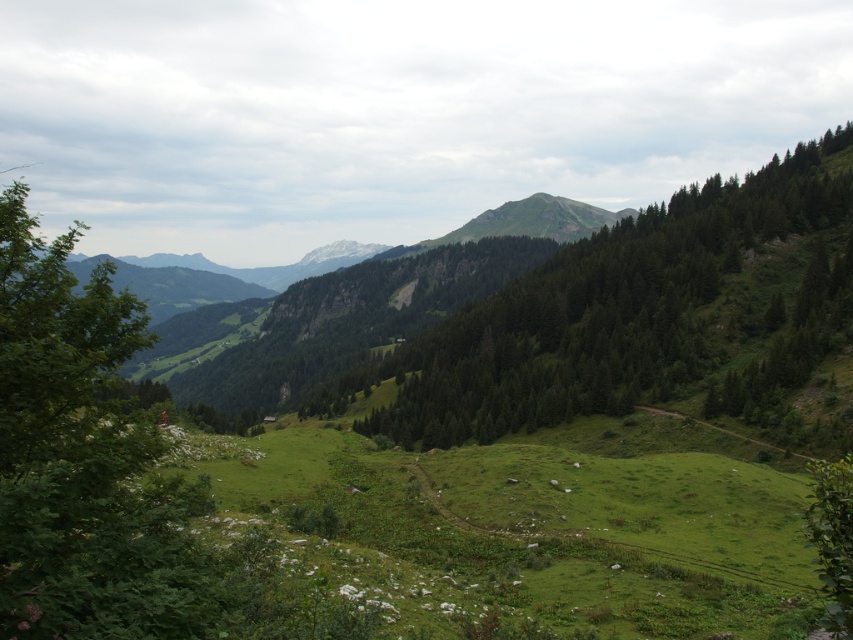
Question: Which point is closer to the camera?

Choices:
 (A) green textured tree at center
 (B) green grassy field at center

Answer: (B)

Question: Among these points, which one is farthest from the camera?

Choices:
 (A) (734, 557)
 (B) (656, 211)

Answer: (B)

Question: Considering the relative positions of green grassy field at center and green leafy tree at left in the image provided, where is green grassy field at center located with respect to green leafy tree at left?

Choices:
 (A) above
 (B) below

Answer: (B)

Question: Can you confirm if green textured tree at center is positioned to the right of green leafy tree at left?

Choices:
 (A) no
 (B) yes

Answer: (B)

Question: Can you confirm if green grassy field at center is wider than green textured tree at center?

Choices:
 (A) yes
 (B) no

Answer: (B)

Question: Estimate the real-world distances between objects in this image. Which object is farther from the green textured tree at center?

Choices:
 (A) green leafy tree at left
 (B) green grassy field at center

Answer: (A)